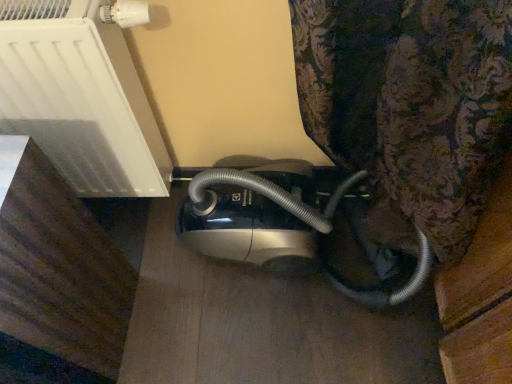
Locate an element on the screen. The width and height of the screenshot is (512, 384). blank area beneath metallic silver vacuum cleaner at center (from a real-world perspective) is located at coordinates (300, 271).